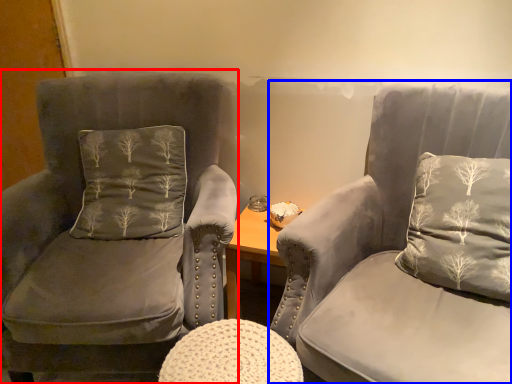
Question: Which object is closer to the camera taking this photo, chair (highlighted by a red box) or chair (highlighted by a blue box)?

Choices:
 (A) chair
 (B) chair

Answer: (B)